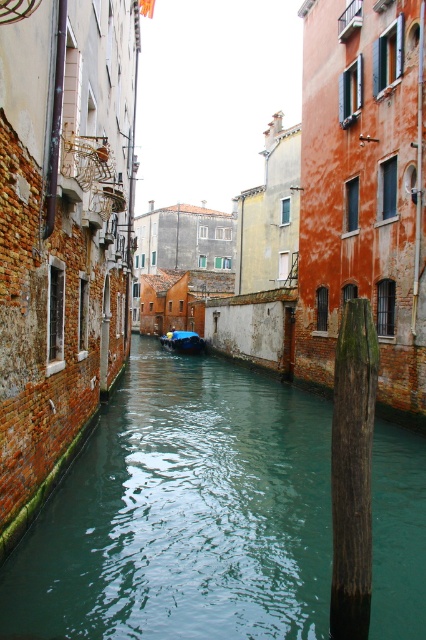
Question: In this image, where is green weathered wood post at center-right located relative to blue glossy boat at center?

Choices:
 (A) above
 (B) below

Answer: (A)

Question: Does green water at center come behind green weathered wood post at center-right?

Choices:
 (A) yes
 (B) no

Answer: (A)

Question: Among these points, which one is farthest from the camera?

Choices:
 (A) (173, 348)
 (B) (290, 458)
 (C) (344, 426)

Answer: (A)

Question: Can you confirm if green water at center is bigger than blue glossy boat at center?

Choices:
 (A) no
 (B) yes

Answer: (B)

Question: Which of the following is the farthest from the observer?

Choices:
 (A) (354, 540)
 (B) (172, 349)

Answer: (B)

Question: Which object is closer to the camera taking this photo?

Choices:
 (A) green weathered wood post at center-right
 (B) green water at center
 (C) blue glossy boat at center

Answer: (A)